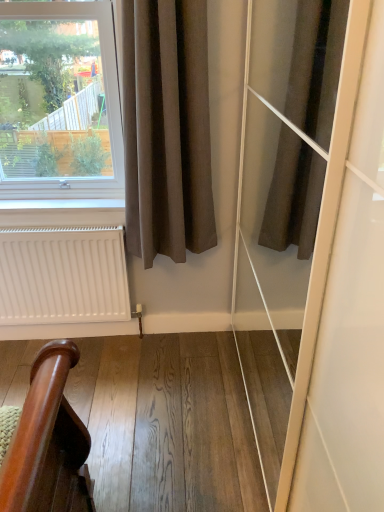
Where is `free space above white matte radiator at lower left (from a real-world perspective)`? The image size is (384, 512). free space above white matte radiator at lower left (from a real-world perspective) is located at coordinates (55, 225).